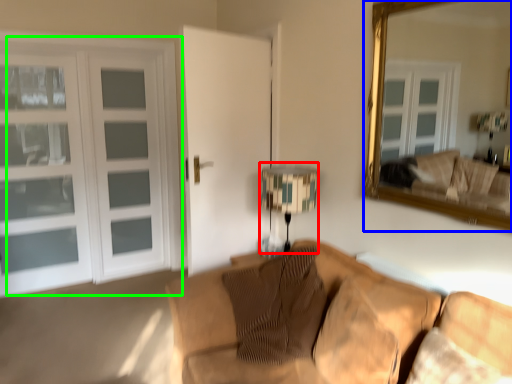
Question: Considering the real-world distances, which object is farthest from table lamp (highlighted by a red box)? mirror (highlighted by a blue box) or door (highlighted by a green box)?

Choices:
 (A) mirror
 (B) door

Answer: (B)